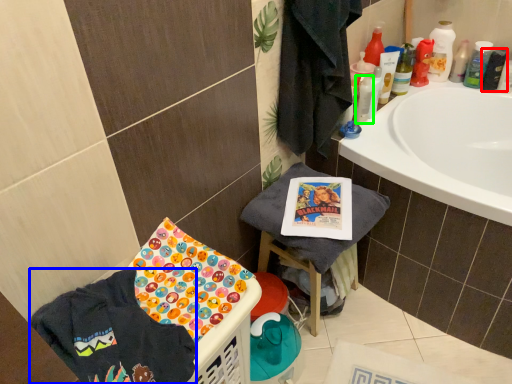
Question: Which is farther away from mouthwash (highlighted by a red box)? clothing (highlighted by a blue box) or mouthwash (highlighted by a green box)?

Choices:
 (A) clothing
 (B) mouthwash

Answer: (A)